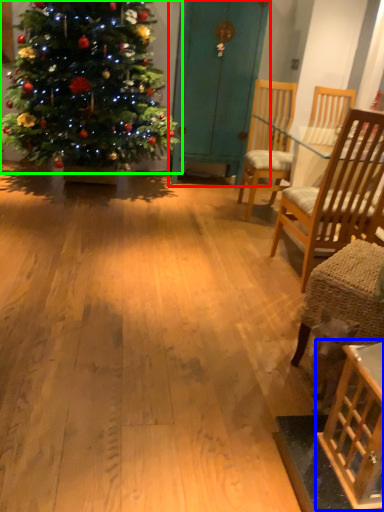
Question: Which object is the closest to the armoire (highlighted by a red box)? Choose among these: table (highlighted by a blue box) or christmas tree (highlighted by a green box).

Choices:
 (A) table
 (B) christmas tree

Answer: (B)